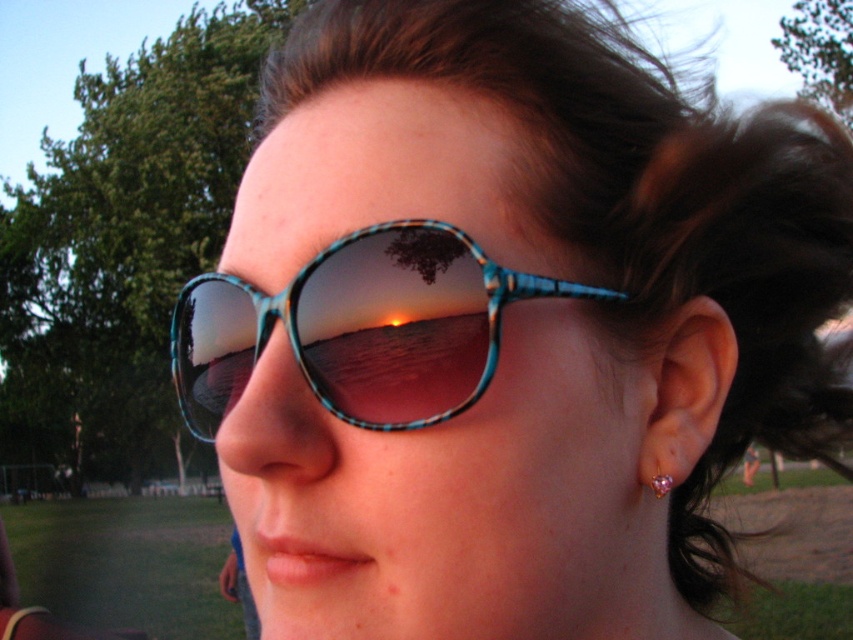
Is brown shiny hair at upper center taller than teal glossy sunglasses at center?

Yes.

Which is more to the right, brown shiny hair at upper center or teal glossy sunglasses at center?

brown shiny hair at upper center

Does point (656, 182) come closer to viewer compared to point (303, 356)?

That is False.

I want to click on brown shiny hair at upper center, so click(x=645, y=205).

Who is taller, brown shiny hair at upper center or pink gemstone earring at ear?

brown shiny hair at upper center

Between point (531, 122) and point (662, 476), which one is positioned behind?

The point (662, 476) is behind.

Locate an element on the screen. The height and width of the screenshot is (640, 853). brown shiny hair at upper center is located at coordinates (645, 205).

From the picture: Is teal glossy sunglasses at center to the right of pink gemstone earring at ear from the viewer's perspective?

In fact, teal glossy sunglasses at center is to the left of pink gemstone earring at ear.

Which is above, teal glossy sunglasses at center or pink gemstone earring at ear?

Positioned higher is teal glossy sunglasses at center.

Locate an element on the screen. teal glossy sunglasses at center is located at coordinates (360, 326).

The width and height of the screenshot is (853, 640). I want to click on teal glossy sunglasses at center, so click(x=360, y=326).